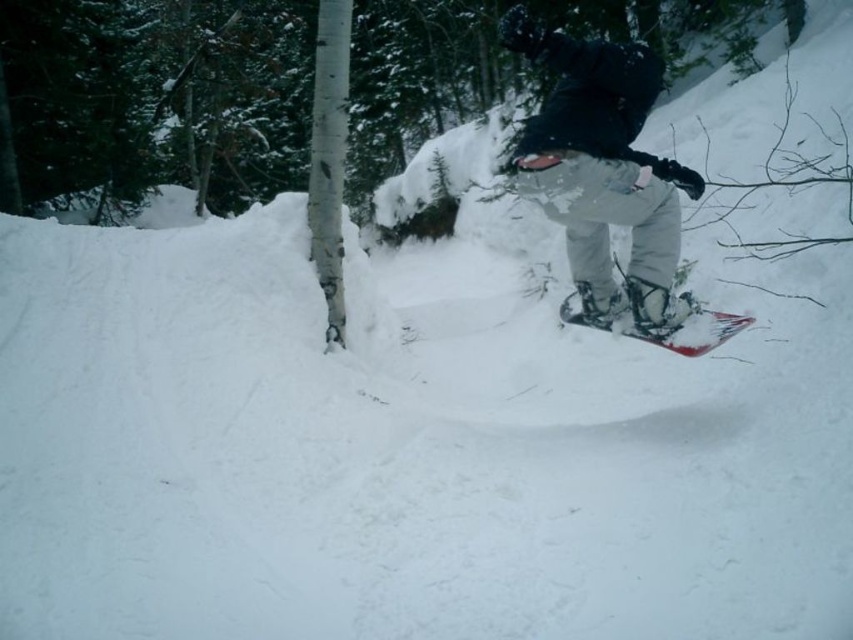
Question: Which point appears closest to the camera in this image?

Choices:
 (A) (728, 328)
 (B) (628, 136)

Answer: (B)

Question: Is the position of matte black snowboard at center more distant than that of red plastic snowboard at center?

Choices:
 (A) no
 (B) yes

Answer: (A)

Question: Which of the following is the closest to the observer?

Choices:
 (A) red plastic snowboard at center
 (B) matte black snowboard at center

Answer: (B)

Question: Is the position of matte black snowboard at center more distant than that of red plastic snowboard at center?

Choices:
 (A) no
 (B) yes

Answer: (A)

Question: Can you confirm if matte black snowboard at center is smaller than red plastic snowboard at center?

Choices:
 (A) yes
 (B) no

Answer: (B)

Question: Which point is farther to the camera?

Choices:
 (A) matte black snowboard at center
 (B) red plastic snowboard at center

Answer: (B)